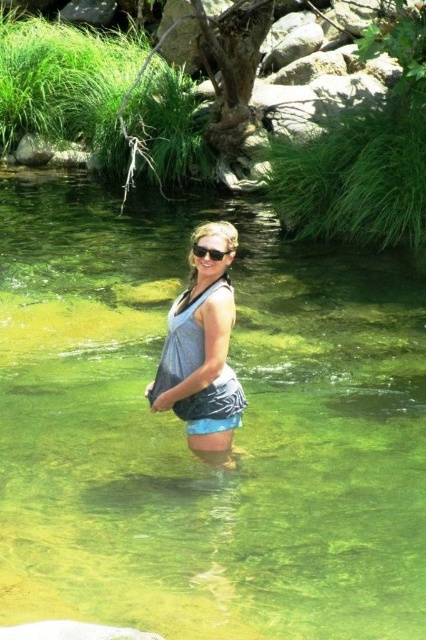
Question: Estimate the real-world distances between objects in this image. Which object is farther from the matte gray bikini top at center?

Choices:
 (A) gray fabric bikini top at center
 (B) black plastic sunglasses at center
 (C) gray fabric tank top at center
 (D) clear water stream at center

Answer: (D)

Question: Which is farther from the gray fabric tank top at center?

Choices:
 (A) gray fabric bikini top at center
 (B) black plastic sunglasses at center
 (C) clear water stream at center
 (D) matte gray bikini top at center

Answer: (C)

Question: Is clear water stream at center positioned in front of gray fabric tank top at center?

Choices:
 (A) no
 (B) yes

Answer: (B)

Question: Does matte gray bikini top at center have a larger size compared to black plastic sunglasses at center?

Choices:
 (A) no
 (B) yes

Answer: (B)

Question: Where is clear water stream at center located in relation to matte gray bikini top at center in the image?

Choices:
 (A) left
 (B) right

Answer: (A)

Question: Which point is closer to the camera taking this photo?

Choices:
 (A) (216, 282)
 (B) (140, 250)
 (C) (216, 253)

Answer: (C)